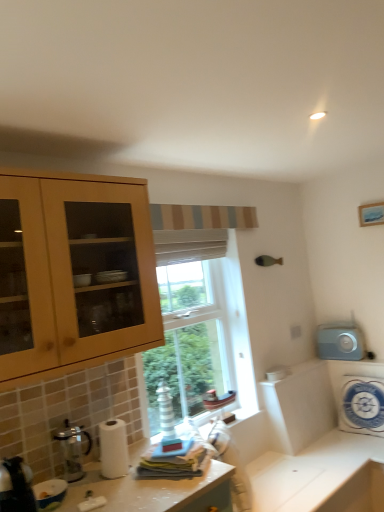
What are the coordinates of `free point above white glossy countertop at lower center (from a real-world perspective)` in the screenshot? It's located at (291, 480).